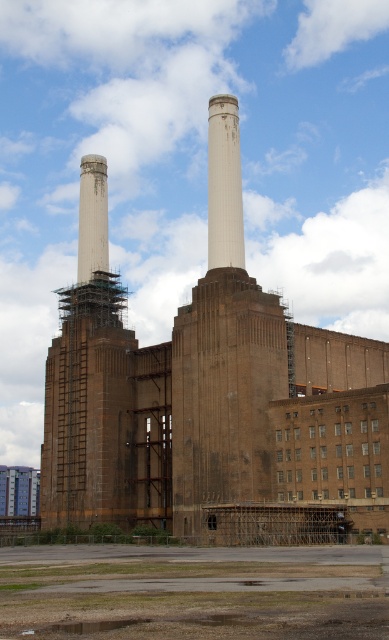
Does brown brick factory at center have a lesser width compared to white concrete chimney at center?

No, brown brick factory at center is not thinner than white concrete chimney at center.

Who is positioned more to the right, brown brick factory at center or white concrete chimney at center?

white concrete chimney at center

Which is in front, point (369, 339) or point (234, 196)?

Point (234, 196) is in front.

This screenshot has width=389, height=640. I want to click on brown brick factory at center, so click(x=212, y=416).

Can you confirm if brown brick chimney at left is wider than white concrete chimney at center?

Yes, brown brick chimney at left is wider than white concrete chimney at center.

In the scene shown: Who is shorter, brown brick chimney at left or white concrete chimney at center?

white concrete chimney at center

Which is behind, point (91, 157) or point (234, 204)?

The point (91, 157) is more distant.

Locate an element on the screen. brown brick chimney at left is located at coordinates click(87, 380).

Which of these two, brown brick factory at center or green leafy plant at lower center, stands shorter?

Standing shorter between the two is green leafy plant at lower center.

Does point (301, 445) come behind point (73, 529)?

No, it is not.

Find the location of a particular element. brown brick factory at center is located at coordinates (212, 416).